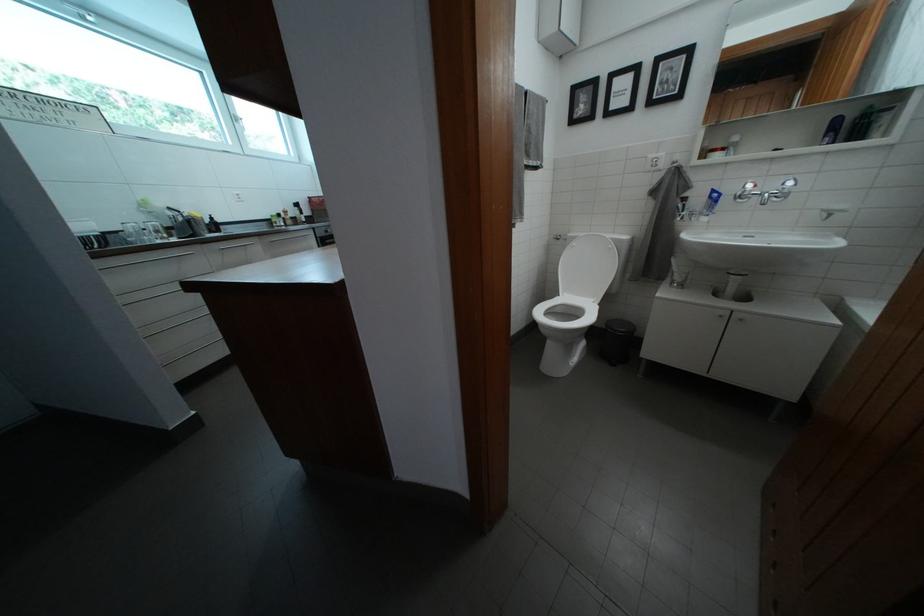
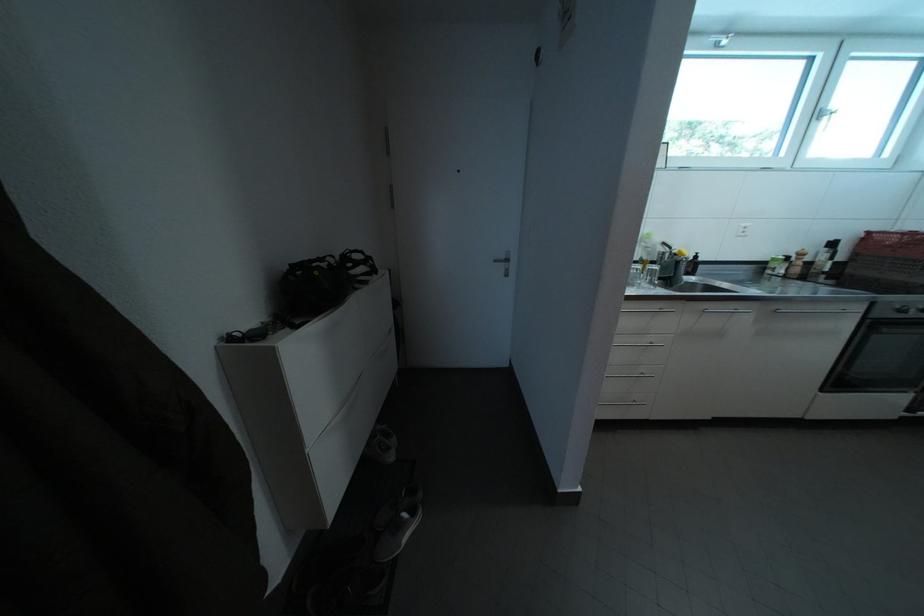
Based on the continuous images, in which direction is the camera rotating?

The rotation direction of the camera is left-down.